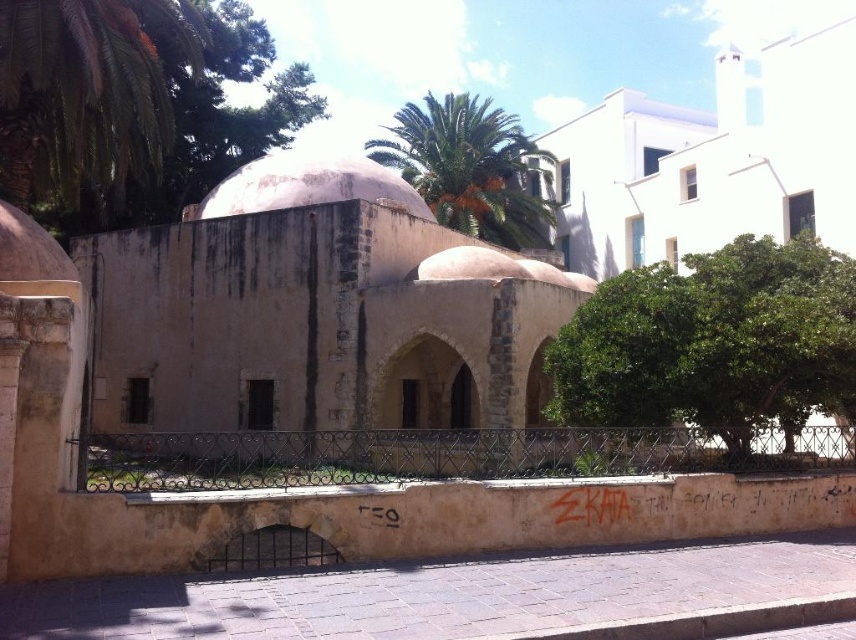
You are standing in front of the historical building with a low wall and graffiti. You want to take a photo of the green leafy palm tree at upper left. Where should you position yourself to capture it in the frame?

To capture the green leafy palm tree at upper left in the frame, position yourself so that the tree is at the coordinates specified by point 0.144 on the horizontal axis and 0.104 on the vertical axis relative to the image.

You are standing at point (88,92) in the image. What do you see in front of you?

You see a green leafy palm tree at upper left in front of you at point (88,92).